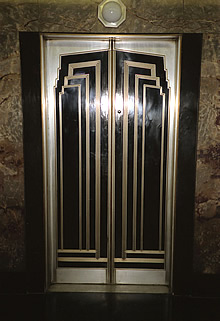
Identify the location of bright white light. (117, 103).